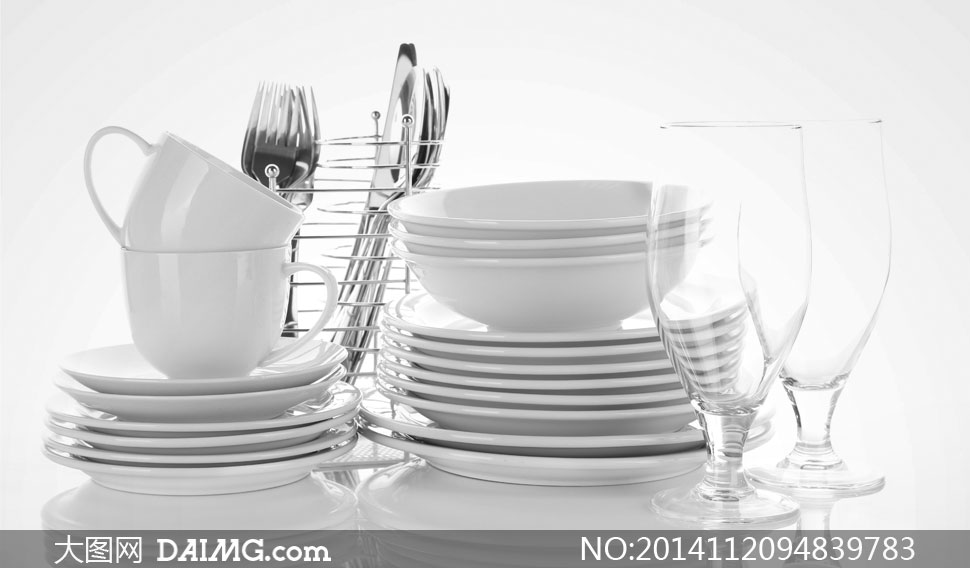
This screenshot has width=970, height=568. What are the coordinates of `eating utensils` in the screenshot? It's located at (269, 144), (246, 144), (305, 151), (313, 124), (406, 55), (408, 94), (430, 106), (444, 102).